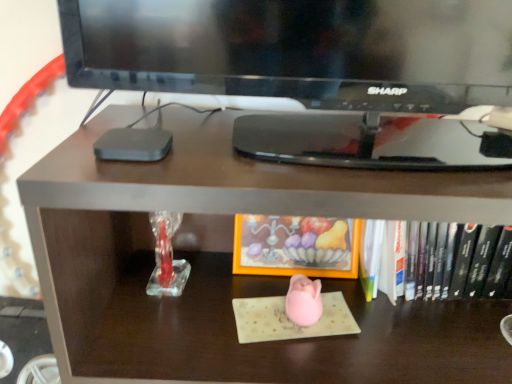
Question: Looking at their shapes, would you say matte brown desk at center is wider or thinner than hardcover book at center, which is the 2th book from left to right?

Choices:
 (A) thin
 (B) wide

Answer: (B)

Question: Is point (309, 339) closer or farther from the camera than point (420, 281)?

Choices:
 (A) farther
 (B) closer

Answer: (B)

Question: Which is farther from the hardcover book at center, which is the 2th book from left to right?

Choices:
 (A) orange matte frame at center, acting as the second book starting from the right
 (B) matte brown desk at center

Answer: (B)

Question: Which object is positioned farthest from the hardcover book at center, which appears as the first book when viewed from the right?

Choices:
 (A) matte brown desk at center
 (B) orange matte frame at center, acting as the second book starting from the right

Answer: (A)